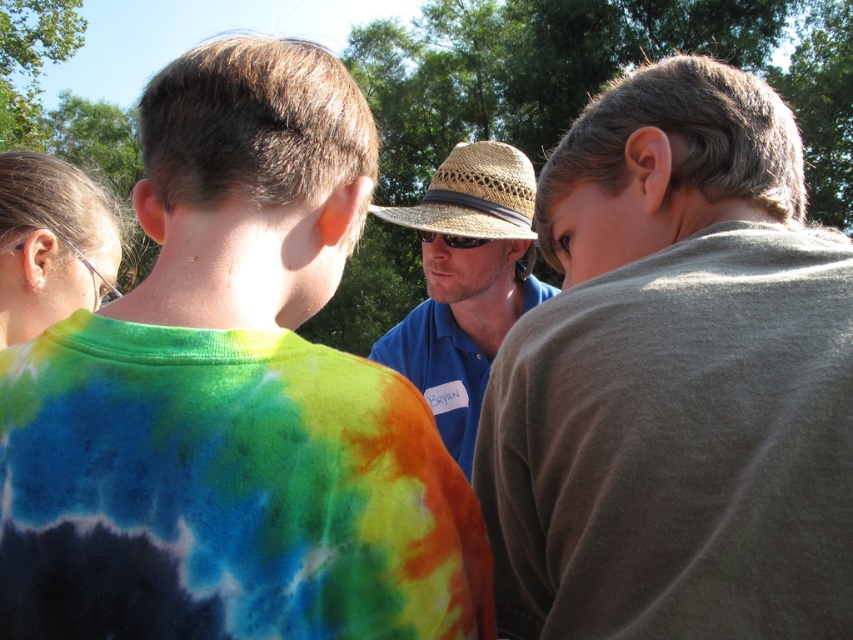
Question: Can you confirm if tie-dye fabric shirt at center is positioned below straw hat at center?

Choices:
 (A) no
 (B) yes

Answer: (B)

Question: Estimate the real-world distances between objects in this image. Which object is closer to the blue shirt at center?

Choices:
 (A) tie-dye fabric shirt at center
 (B) straw hat at center
 (C) clear plastic glasses at left

Answer: (A)

Question: Can you confirm if blue shirt at center is positioned to the left of clear plastic glasses at left?

Choices:
 (A) no
 (B) yes

Answer: (A)

Question: Which point is farther to the camera?

Choices:
 (A) (26, 460)
 (B) (489, 248)
 (C) (111, 275)

Answer: (B)

Question: Which object is closer to the camera taking this photo?

Choices:
 (A) clear plastic glasses at left
 (B) straw hat at center
 (C) tie-dye fabric shirt at center
 (D) blue shirt at center

Answer: (C)

Question: Is tie-dye fabric shirt at center further to the viewer compared to straw hat at center?

Choices:
 (A) yes
 (B) no

Answer: (B)